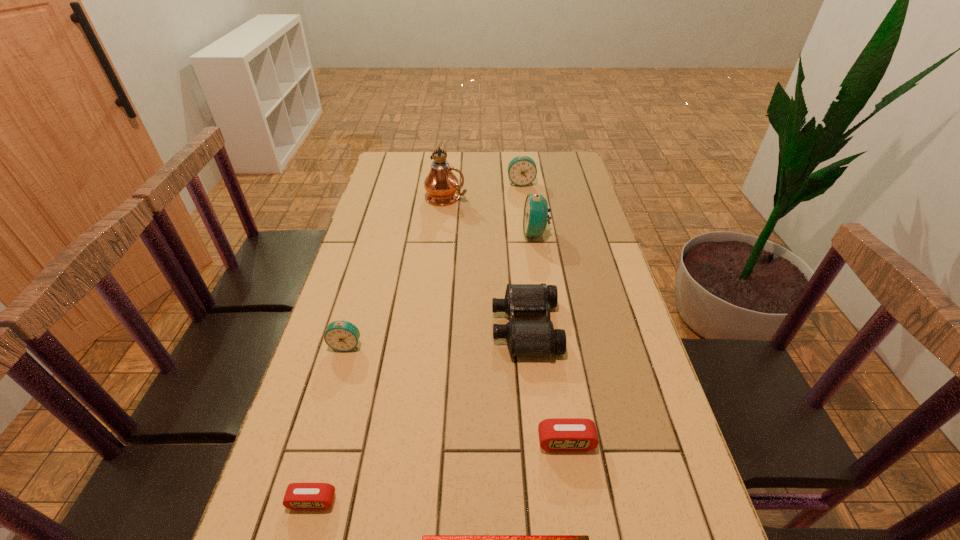
The image size is (960, 540). In order to click on free location that satisfies the following two spatial constraints: 1. through the eyepieces of the binoculars; 2. on the front-facing side of the nearest alarm clock in this screenshot , I will do `click(543, 502)`.